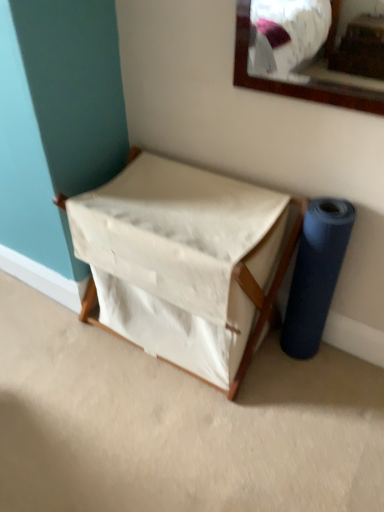
This screenshot has height=512, width=384. Describe the element at coordinates (316, 274) in the screenshot. I see `blue rubber roll at right` at that location.

What is the approximate width of blue rubber roll at right?

The width of blue rubber roll at right is 5.40 inches.

Image resolution: width=384 pixels, height=512 pixels. In order to click on blue rubber roll at right in this screenshot , I will do `click(316, 274)`.

Describe the element at coordinates (184, 263) in the screenshot. This screenshot has width=384, height=512. I see `white canvas laundry basket at center` at that location.

Identify the location of white canvas laundry basket at center. The height and width of the screenshot is (512, 384). (184, 263).

Find the location of a particular element. This screenshot has width=384, height=512. blue rubber roll at right is located at coordinates (316, 274).

Based on their positions, is white canvas laundry basket at center located to the left or right of blue rubber roll at right?

Based on their positions, white canvas laundry basket at center is located to the left of blue rubber roll at right.

Is the depth of white canvas laundry basket at center greater than that of blue rubber roll at right?

No, it is not.

Which is farther from the camera, (154, 316) or (318, 278)?

Positioned behind is point (154, 316).

From the image's perspective, is white canvas laundry basket at center below blue rubber roll at right?

No.

From a real-world perspective, is white canvas laundry basket at center positioned above or below blue rubber roll at right?

From a real-world perspective, white canvas laundry basket at center is physically below blue rubber roll at right.

Does white canvas laundry basket at center have a greater width compared to blue rubber roll at right?

Correct, the width of white canvas laundry basket at center exceeds that of blue rubber roll at right.

Which of these two, white canvas laundry basket at center or blue rubber roll at right, stands shorter?

white canvas laundry basket at center.

Considering the sizes of objects white canvas laundry basket at center and blue rubber roll at right in the image provided, who is smaller, white canvas laundry basket at center or blue rubber roll at right?

With smaller size is blue rubber roll at right.

Is blue rubber roll at right a part of white canvas laundry basket at center?

No, blue rubber roll at right is not surrounded by white canvas laundry basket at center.

Are white canvas laundry basket at center and blue rubber roll at right located far from each other?

No, there isn't a large distance between white canvas laundry basket at center and blue rubber roll at right.

Is white canvas laundry basket at center turned away from blue rubber roll at right?

No, blue rubber roll at right is not at the back of white canvas laundry basket at center.

How much distance is there between white canvas laundry basket at center and blue rubber roll at right?

A distance of 13.29 inches exists between white canvas laundry basket at center and blue rubber roll at right.

This screenshot has width=384, height=512. Identify the location of duct tape lying behind the white canvas laundry basket at center. [x=316, y=274].

Which is more to the right, blue rubber roll at right or white canvas laundry basket at center?

From the viewer's perspective, blue rubber roll at right appears more on the right side.

Is blue rubber roll at right behind white canvas laundry basket at center?

Yes, it is behind white canvas laundry basket at center.

Which is further, (318, 214) or (232, 327)?

The point (232, 327) is more distant.

From the image's perspective, is blue rubber roll at right below white canvas laundry basket at center?

Correct, blue rubber roll at right appears lower than white canvas laundry basket at center in the image.

From a real-world perspective, which object rests below the other?

white canvas laundry basket at center is physically lower.

Which of these two, blue rubber roll at right or white canvas laundry basket at center, is thinner?

blue rubber roll at right.

Looking at this image, considering the sizes of objects blue rubber roll at right and white canvas laundry basket at center in the image provided, who is shorter, blue rubber roll at right or white canvas laundry basket at center?

With less height is white canvas laundry basket at center.

Who is smaller, blue rubber roll at right or white canvas laundry basket at center?

Smaller between the two is blue rubber roll at right.

Is blue rubber roll at right spatially inside white canvas laundry basket at center, or outside of it?

blue rubber roll at right cannot be found inside white canvas laundry basket at center.

Is blue rubber roll at right with white canvas laundry basket at center?

No, blue rubber roll at right is not in contact with white canvas laundry basket at center.

Is blue rubber roll at right oriented away from white canvas laundry basket at center?

blue rubber roll at right does not have its back to white canvas laundry basket at center.

From the picture: Measure the distance between blue rubber roll at right and white canvas laundry basket at center.

13.29 inches.

This screenshot has height=512, width=384. I want to click on duct tape that appears on the right of white canvas laundry basket at center, so coord(316,274).

Identify the location of duct tape located on the right of white canvas laundry basket at center. The image size is (384, 512). (316, 274).

Image resolution: width=384 pixels, height=512 pixels. I want to click on furniture below the blue rubber roll at right (from a real-world perspective), so click(184, 263).